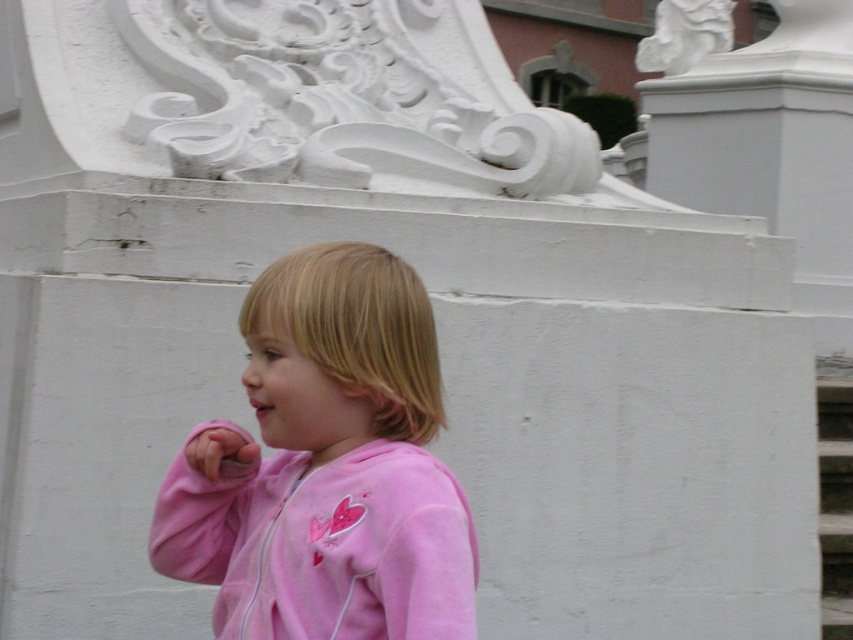
Between pink fleece jacket at center and white textured stair at lower right, which one has more height?

Standing taller between the two is pink fleece jacket at center.

Is point (345, 410) closer to camera compared to point (845, 554)?

Yes, it is in front of point (845, 554).

Find the location of `pink fleece jacket at center`. pink fleece jacket at center is located at coordinates (328, 467).